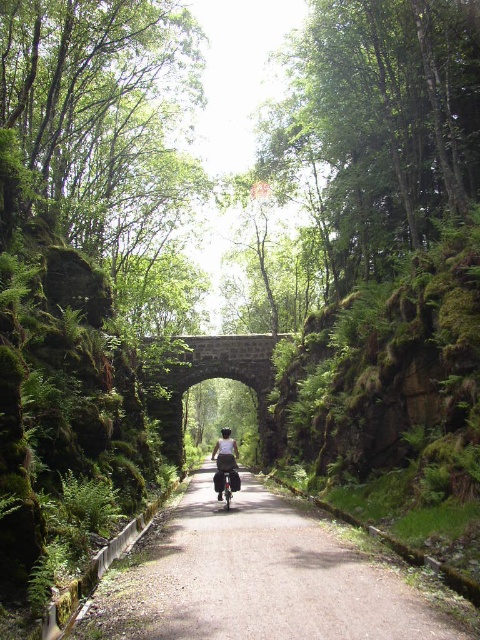
Who is positioned more to the left, gravel road at center or stone archway at center?

From the viewer's perspective, stone archway at center appears more on the left side.

Measure the distance from gravel road at center to stone archway at center.

gravel road at center is 181.60 feet away from stone archway at center.

What do you see at coordinates (264, 577) in the screenshot?
I see `gravel road at center` at bounding box center [264, 577].

Identify the location of gravel road at center. (264, 577).

Consider the image. Is gravel road at center to the left of white fabric shirt at center from the viewer's perspective?

Answer: In fact, gravel road at center is to the right of white fabric shirt at center.

Is point (408, 568) closer to viewer compared to point (228, 468)?

That is True.

You are a GUI agent. You are given a task and a screenshot of the screen. Output one action in this format:
    pyautogui.click(x=<x>, y=<y>)
    Task: Click on the gravel road at center
    The width and height of the screenshot is (480, 640).
    Given the screenshot: What is the action you would take?
    pyautogui.click(x=264, y=577)

Is stone archway at center wider than white fabric shirt at center?

Indeed, stone archway at center has a greater width compared to white fabric shirt at center.

Locate an element on the screen. The height and width of the screenshot is (640, 480). stone archway at center is located at coordinates (208, 378).

Which is in front, point (240, 340) or point (220, 454)?

Point (220, 454) is more forward.

Locate an element on the screen. This screenshot has width=480, height=640. stone archway at center is located at coordinates (208, 378).